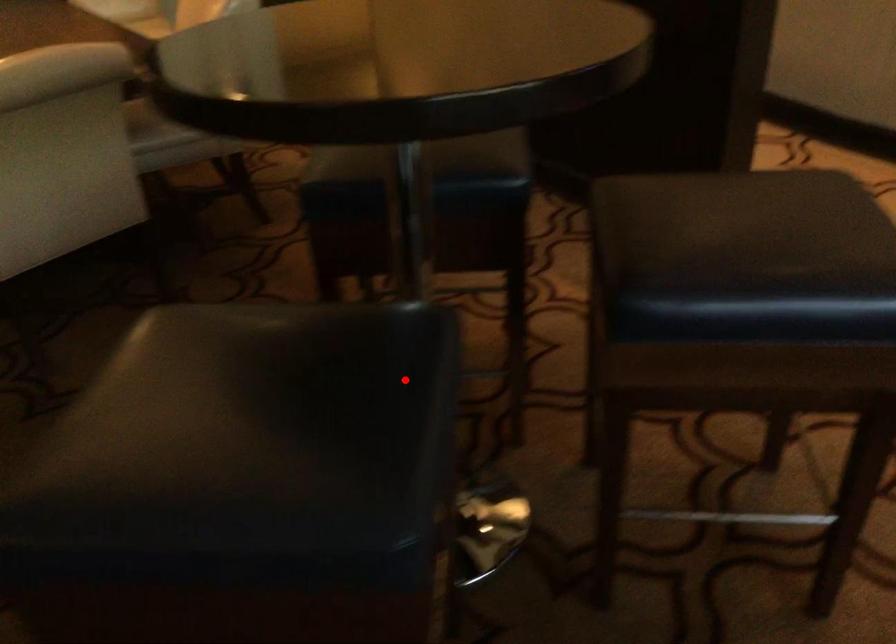
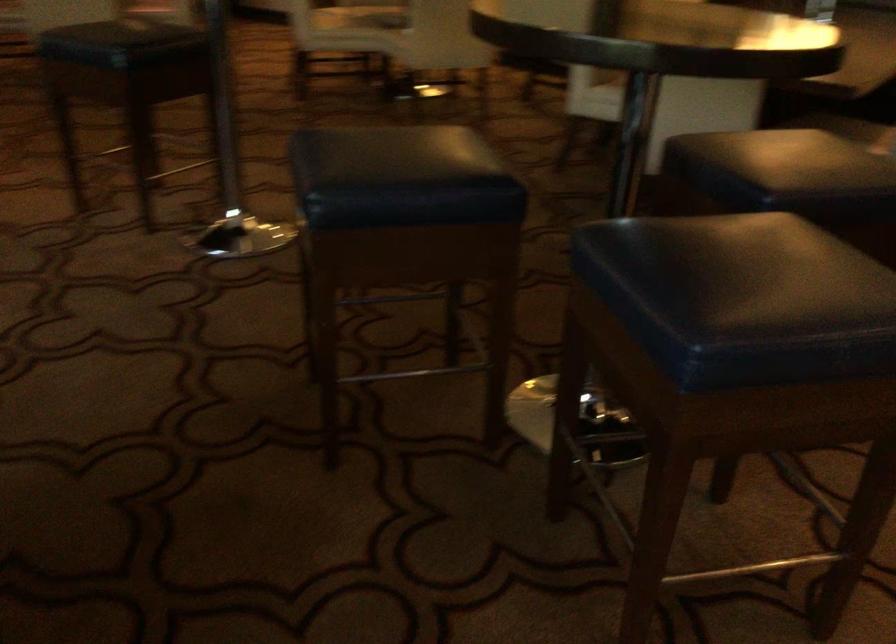
Where in the second image is the point corresponding to the highlighted location from the first image?

(401, 178)